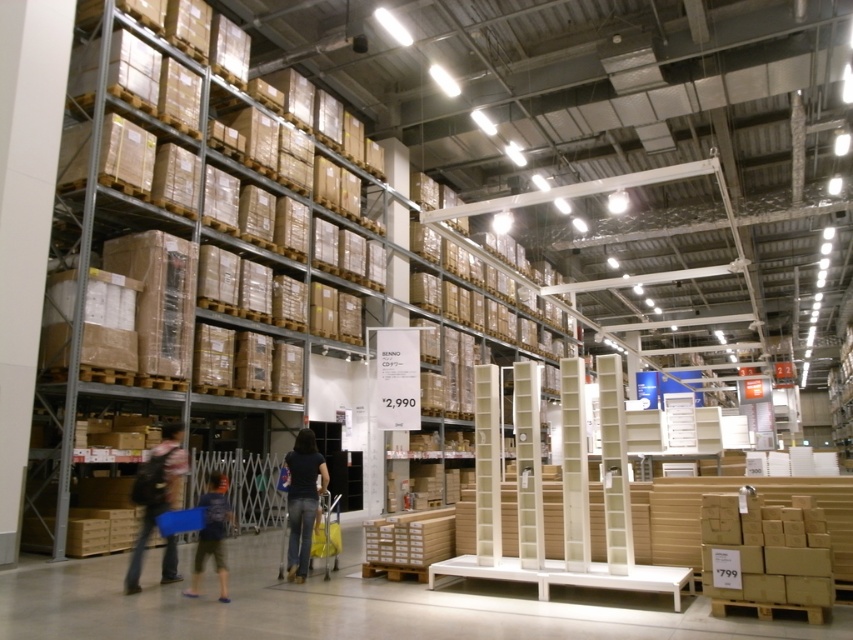
You are a customer in the store and want to pick up both the denim jacket at lower left and the dark blue jeans at lower left. Which item is closer to you as you approach the display?

The denim jacket at lower left is closer to you than the dark blue jeans at lower left because it is further to the viewer.

You are a customer in a store and you want to buy a shirt. You see the denim jacket at lower left and the dark blue shirt at center. Which item is larger in size?

The denim jacket at lower left is bigger than the dark blue shirt at center.

You are a customer in the store and want to find the dark blue shirt at center. Where should you look in the store?

The dark blue shirt at center is located at the 2D coordinates point (302, 500) in the store.